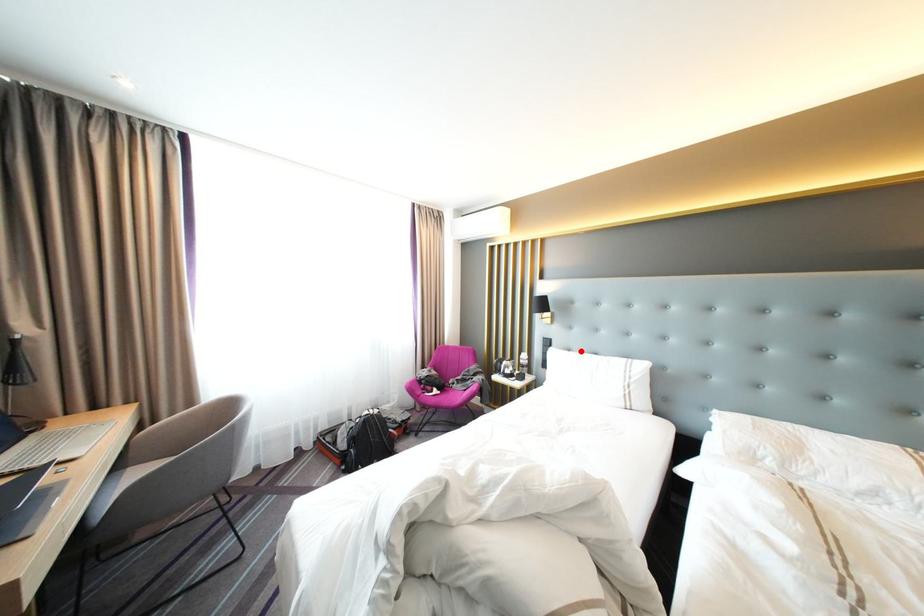
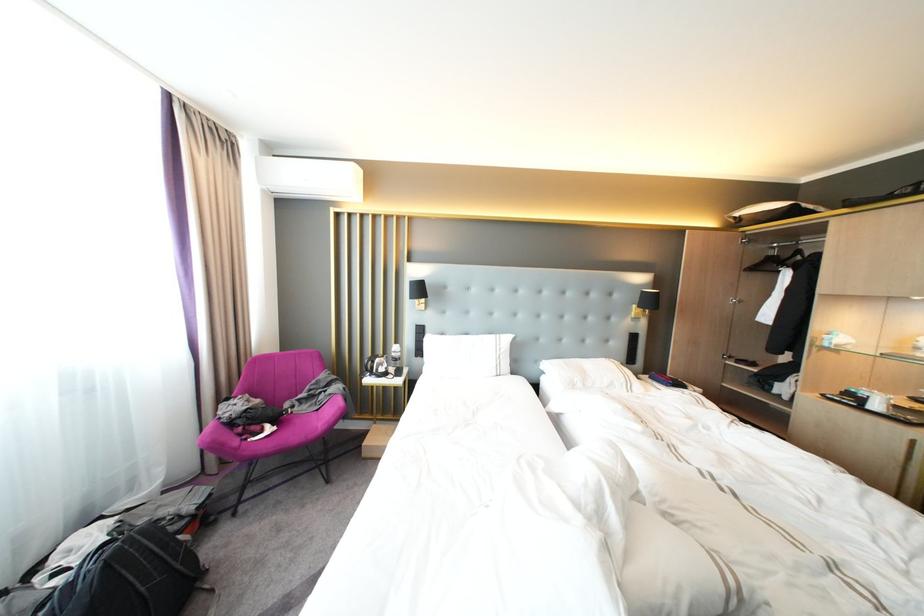
Question: I am providing you with two images of the same scene from different viewpoints. A red point is marked on the first image. Can you still see the location of the red point in image 2?

Choices:
 (A) Yes
 (B) No

Answer: (A)